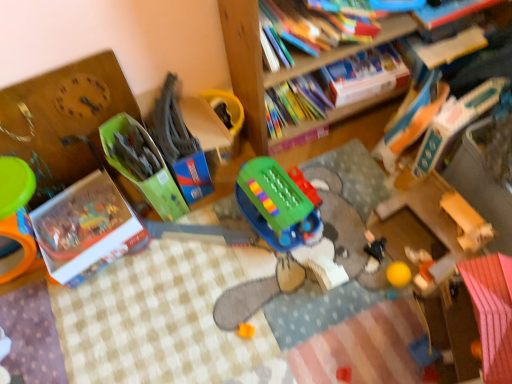
The height and width of the screenshot is (384, 512). I want to click on empty space that is to the right of green plastic toy at center, positioned as the third toy in right-to-left order, so click(x=351, y=223).